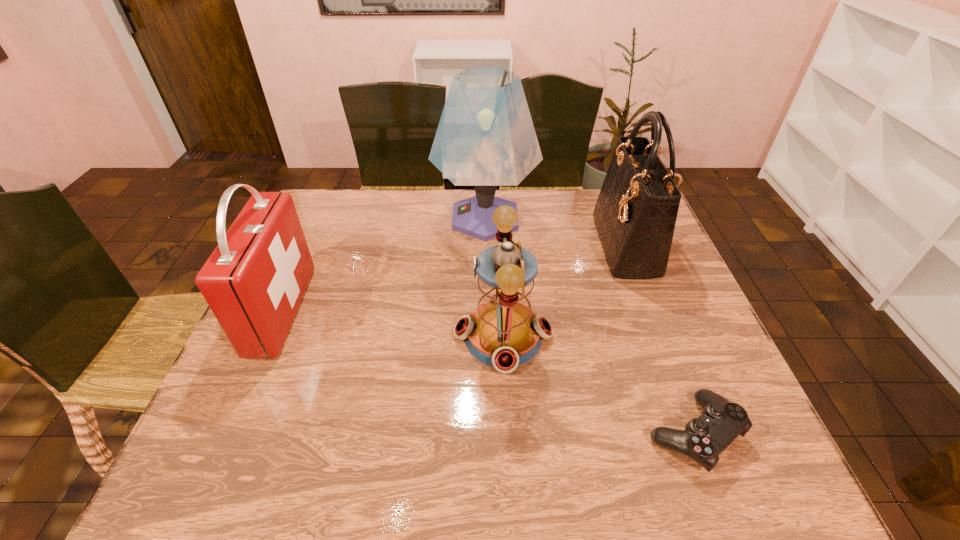
Select which object is the closest to the fourth tallest object. Please provide its 2D coordinates. Your answer should be formatted as a tuple, i.e. [(x, y)], where the tuple contains the x and y coordinates of a point satisfying the conditions above.

[(704, 438)]

Image resolution: width=960 pixels, height=540 pixels. In order to click on free space that satisfies the following two spatial constraints: 1. on the back side of the shortest object; 2. on the front-facing side of the fourth tallest object in this screenshot , I will do `click(657, 336)`.

Where is `vacant space that satisfies the following two spatial constraints: 1. on the front face of the leftmost object; 2. on the right side of the shortest object`? The width and height of the screenshot is (960, 540). vacant space that satisfies the following two spatial constraints: 1. on the front face of the leftmost object; 2. on the right side of the shortest object is located at coordinates (227, 434).

Where is `vacant space that satisfies the following two spatial constraints: 1. on the back side of the shortest object; 2. on the base of the lampshade`? vacant space that satisfies the following two spatial constraints: 1. on the back side of the shortest object; 2. on the base of the lampshade is located at coordinates (612, 218).